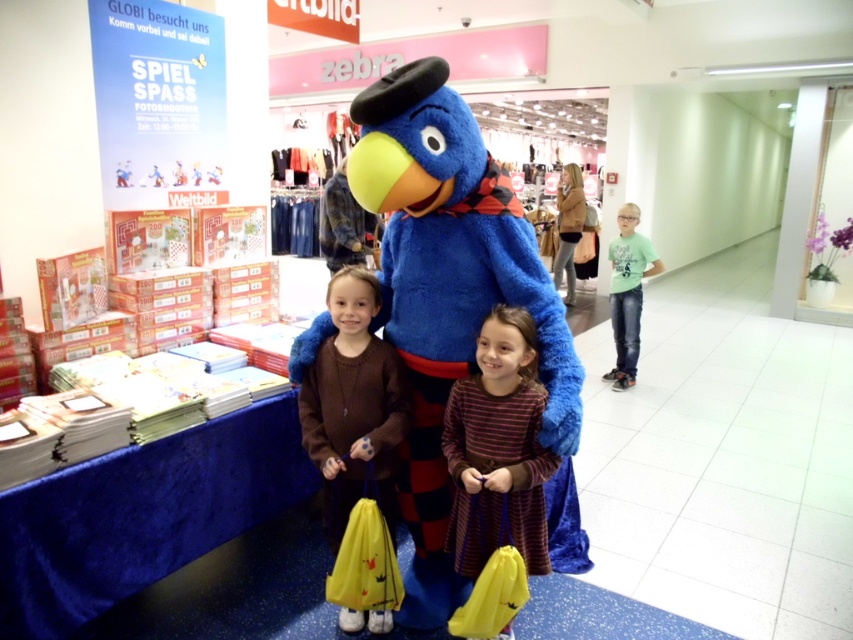
You are helping a customer find the right size for their child. You see the brown woolen sweater at center and the green cotton shirt at right. Which one is more suitable for a child who needs a larger size?

The green cotton shirt at right is larger than the brown woolen sweater at center, so it is more suitable for a child who needs a larger size.

You are a customer in the store and want to find the blue plush bird at center. According to the store layout, where should you look relative to the shelves labeled Weltbild?

The blue plush bird at center is located at the 2D coordinates point (456, 307), which places it near the center of the store. Since the shelves labeled Weltbild are in the background, the blue plush bird at center is positioned in front of those shelves.